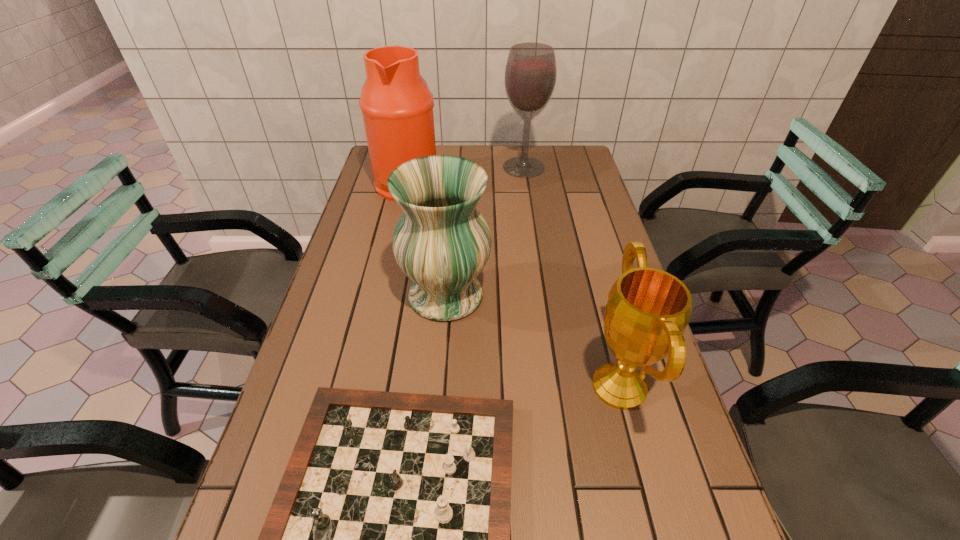
The width and height of the screenshot is (960, 540). I want to click on water jug, so click(397, 107).

The height and width of the screenshot is (540, 960). I want to click on alcohol, so click(530, 75).

You are a GUI agent. You are given a task and a screenshot of the screen. Output one action in this format:
    pyautogui.click(x=<x>, y=<y>)
    Task: Click on the vase
    Image resolution: width=960 pixels, height=540 pixels.
    Given the screenshot: What is the action you would take?
    pyautogui.click(x=441, y=242)

At what (x,y) coordinates should I click in order to perform the action: click on award. Please return your answer as a coordinate pair (x, y). Looking at the image, I should click on (648, 309).

Image resolution: width=960 pixels, height=540 pixels. I want to click on free region located 0.160m from the spout of the water jug, so click(x=485, y=182).

What are the coordinates of `vacant space located on the left of the alcohol` in the screenshot? It's located at 448,167.

At what (x,y) coordinates should I click in order to perform the action: click on vacant region located on the left of the vase. Please return your answer as a coordinate pair (x, y). Looking at the image, I should click on (348, 295).

You are a GUI agent. You are given a task and a screenshot of the screen. Output one action in this format:
    pyautogui.click(x=<x>, y=<y>)
    Task: Click on the vacant space situated on the front-facing side of the award
    
    Given the screenshot: What is the action you would take?
    pyautogui.click(x=481, y=386)

The image size is (960, 540). I want to click on free space located on the front-facing side of the award, so coord(499,386).

The height and width of the screenshot is (540, 960). I want to click on vacant space located 0.390m on the front-facing side of the award, so click(x=407, y=386).